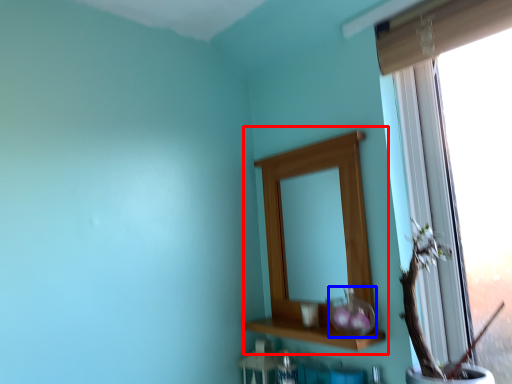
Question: Which object appears farthest to the camera in this image, medicine cabinet (highlighted by a red box) or glass vase (highlighted by a blue box)?

Choices:
 (A) medicine cabinet
 (B) glass vase

Answer: (A)